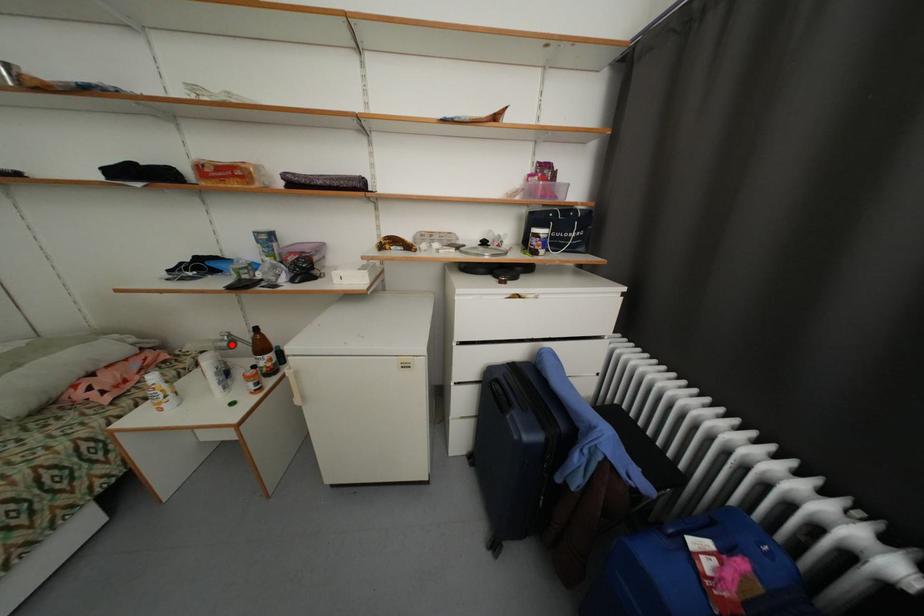
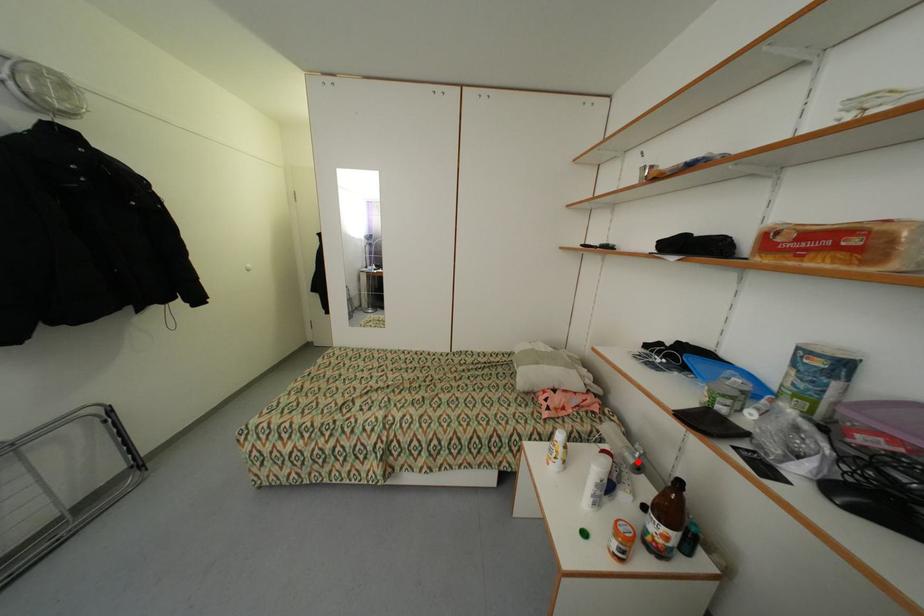
I am providing you with two images of the same scene from different viewpoints. A red point is marked on the first image and another point is marked on the second image. Is the marked point in image1 the same physical position as the marked point in image2?

Yes